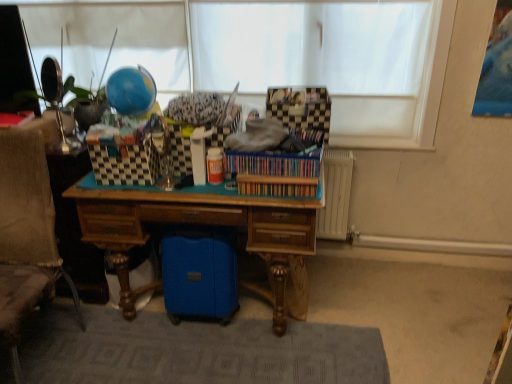
Question: Which direction should I rotate to look at wooden bookshelf at center, which appears as the second book when viewed from the top?

Choices:
 (A) left
 (B) right

Answer: (B)

Question: Can you confirm if gray textured rug at lower center is thinner than textured beige fabric swivel chair at left?

Choices:
 (A) yes
 (B) no

Answer: (B)

Question: Considering the relative sizes of gray textured rug at lower center and textured beige fabric swivel chair at left in the image provided, is gray textured rug at lower center shorter than textured beige fabric swivel chair at left?

Choices:
 (A) yes
 (B) no

Answer: (A)

Question: Can you confirm if gray textured rug at lower center is bigger than textured beige fabric swivel chair at left?

Choices:
 (A) yes
 (B) no

Answer: (B)

Question: Is gray textured rug at lower center at the right side of textured beige fabric swivel chair at left?

Choices:
 (A) no
 (B) yes

Answer: (B)

Question: From the image's perspective, is gray textured rug at lower center located beneath textured beige fabric swivel chair at left?

Choices:
 (A) no
 (B) yes

Answer: (B)

Question: From a real-world perspective, is gray textured rug at lower center beneath textured beige fabric swivel chair at left?

Choices:
 (A) yes
 (B) no

Answer: (A)

Question: Would you consider checkerboard-patterned fabric at upper center to be distant from textured beige fabric swivel chair at left?

Choices:
 (A) yes
 (B) no

Answer: (A)

Question: From a real-world perspective, is checkerboard-patterned fabric at upper center positioned under textured beige fabric swivel chair at left based on gravity?

Choices:
 (A) no
 (B) yes

Answer: (A)

Question: Does checkerboard-patterned fabric at upper center have a greater height compared to textured beige fabric swivel chair at left?

Choices:
 (A) yes
 (B) no

Answer: (B)

Question: Does checkerboard-patterned fabric at upper center have a smaller size compared to textured beige fabric swivel chair at left?

Choices:
 (A) yes
 (B) no

Answer: (A)

Question: Does checkerboard-patterned fabric at upper center appear on the right side of textured beige fabric swivel chair at left?

Choices:
 (A) no
 (B) yes

Answer: (B)

Question: From a real-world perspective, is checkerboard-patterned fabric at upper center on top of textured beige fabric swivel chair at left?

Choices:
 (A) yes
 (B) no

Answer: (A)

Question: From the image's perspective, is gray textured rug at lower center on top of wooden desk at center?

Choices:
 (A) yes
 (B) no

Answer: (B)